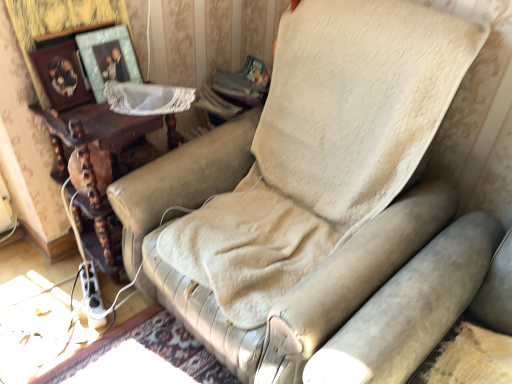
Identify the location of vacant region above brown wooden table at left (from a real-world perspective). The image size is (512, 384). (96, 111).